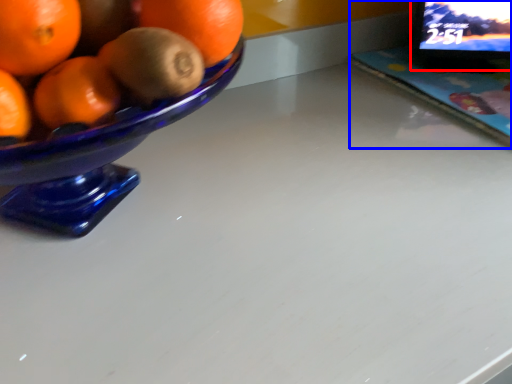
Question: Which object appears farthest to the camera in this image, computer monitor (highlighted by a red box) or laptop (highlighted by a blue box)?

Choices:
 (A) computer monitor
 (B) laptop

Answer: (A)